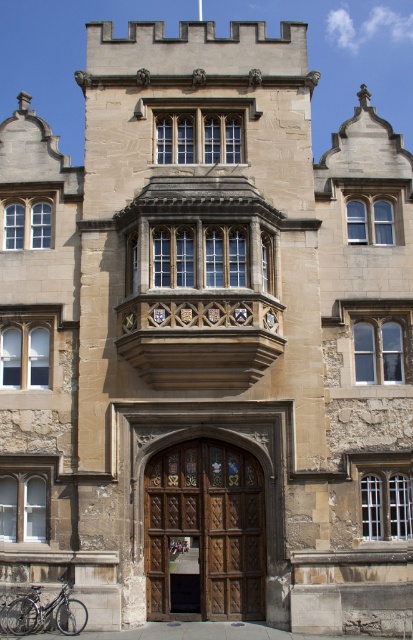
Question: Among these objects, which one is farthest from the camera?

Choices:
 (A) shiny metallic bicycle at lower left
 (B) brown wooden door at center

Answer: (B)

Question: Can you confirm if brown wooden door at center is positioned to the left of shiny metallic bicycle at lower left?

Choices:
 (A) no
 (B) yes

Answer: (A)

Question: Among these objects, which one is nearest to the camera?

Choices:
 (A) shiny metallic bicycle at lower left
 (B) brown wooden door at center

Answer: (A)

Question: Is brown wooden door at center smaller than shiny metallic bicycle at lower left?

Choices:
 (A) no
 (B) yes

Answer: (A)

Question: Does brown wooden door at center have a greater width compared to shiny metallic bicycle at lower left?

Choices:
 (A) no
 (B) yes

Answer: (B)